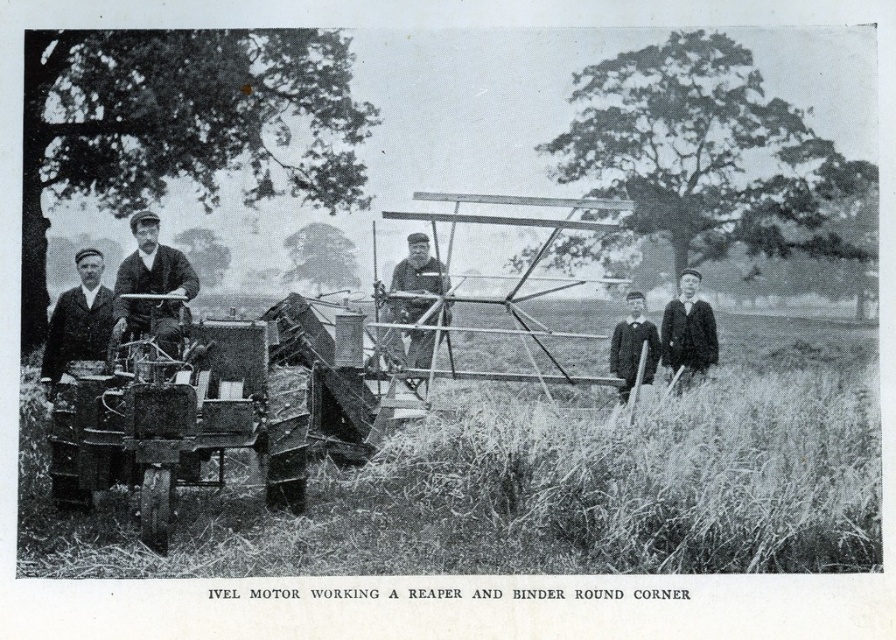
Who is shorter, smooth black suit at right or dark woolen sweater at center?

dark woolen sweater at center is shorter.

Does point (678, 333) come behind point (619, 388)?

Yes, it is.

I want to click on smooth black suit at right, so click(687, 332).

Is point (134, 252) positioned after point (409, 241)?

No, it is in front of (409, 241).

Who is lower down, smooth leather jacket at center or smooth wood chair at center?

smooth wood chair at center is lower down.

You are a GUI agent. You are given a task and a screenshot of the screen. Output one action in this format:
    pyautogui.click(x=<x>, y=<y>)
    Task: Click on the smooth leather jacket at center
    Image resolution: width=896 pixels, height=640 pixels.
    Given the screenshot: What is the action you would take?
    pyautogui.click(x=151, y=289)

Which is in front, point (141, 317) or point (76, 333)?

Positioned in front is point (141, 317).

Does point (182, 260) lie in front of point (93, 280)?

Yes.

I want to click on smooth leather jacket at center, so click(151, 289).